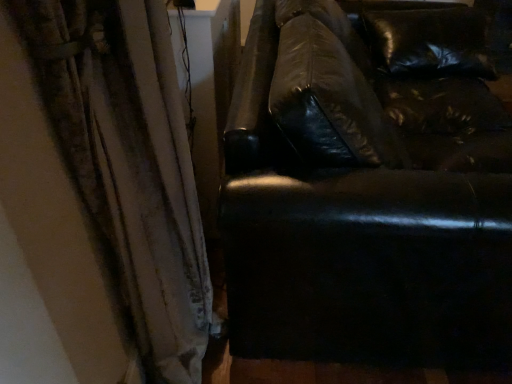
Image resolution: width=512 pixels, height=384 pixels. In order to click on shiny black leather couch at right in this screenshot , I will do `click(368, 191)`.

This screenshot has width=512, height=384. What do you see at coordinates (368, 191) in the screenshot?
I see `shiny black leather couch at right` at bounding box center [368, 191].

Measure the distance between point (225, 233) and camera.

A distance of 34.72 inches exists between point (225, 233) and camera.

The width and height of the screenshot is (512, 384). I want to click on white textured curtain at left, so [x=128, y=162].

What do you see at coordinates (128, 162) in the screenshot? This screenshot has width=512, height=384. I see `white textured curtain at left` at bounding box center [128, 162].

What are the coordinates of `shiny black leather couch at right` in the screenshot? It's located at (368, 191).

Considering the positions of objects shiny black leather couch at right and white textured curtain at left in the image provided, who is more to the right, shiny black leather couch at right or white textured curtain at left?

Positioned to the right is shiny black leather couch at right.

Is the position of shiny black leather couch at right more distant than that of white textured curtain at left?

Yes, shiny black leather couch at right is further from the camera.

Is point (291, 192) positioned behind point (204, 291)?

That is False.

From the image's perspective, is shiny black leather couch at right above white textured curtain at left?

Correct, shiny black leather couch at right appears higher than white textured curtain at left in the image.

From a real-world perspective, relative to white textured curtain at left, is shiny black leather couch at right vertically above or below?

In terms of real-world spatial position, shiny black leather couch at right is below white textured curtain at left.

Can you confirm if shiny black leather couch at right is wider than white textured curtain at left?

Yes.

Can you confirm if shiny black leather couch at right is taller than white textured curtain at left?

No.

Between shiny black leather couch at right and white textured curtain at left, which one has larger size?

shiny black leather couch at right is bigger.

Consider the image. Is shiny black leather couch at right surrounding white textured curtain at left?

No, white textured curtain at left is not surrounded by shiny black leather couch at right.

Is shiny black leather couch at right touching white textured curtain at left?

No, shiny black leather couch at right is not beside white textured curtain at left.

Is shiny black leather couch at right aimed at white textured curtain at left?

No, shiny black leather couch at right is not turned towards white textured curtain at left.

How far apart are shiny black leather couch at right and white textured curtain at left?

shiny black leather couch at right is 13.21 inches from white textured curtain at left.

Locate an element on the screen. The height and width of the screenshot is (384, 512). curtain on the left of shiny black leather couch at right is located at coordinates (128, 162).

Between white textured curtain at left and shiny black leather couch at right, which one appears on the left side from the viewer's perspective?

white textured curtain at left.

Is white textured curtain at left in front of or behind shiny black leather couch at right in the image?

Clearly, white textured curtain at left is in front of shiny black leather couch at right.

Which is less distant, (x=134, y=180) or (x=364, y=253)?

Clearly, point (x=134, y=180) is closer to the camera than point (x=364, y=253).

From the image's perspective, between white textured curtain at left and shiny black leather couch at right, who is located below?

white textured curtain at left.

From a real-world perspective, between white textured curtain at left and shiny black leather couch at right, who is vertically lower?

shiny black leather couch at right, from a real-world perspective.

Between white textured curtain at left and shiny black leather couch at right, which one has larger width?

shiny black leather couch at right.

Who is taller, white textured curtain at left or shiny black leather couch at right?

Standing taller between the two is white textured curtain at left.

Can you confirm if white textured curtain at left is smaller than shiny black leather couch at right?

Correct, white textured curtain at left occupies less space than shiny black leather couch at right.

Is shiny black leather couch at right a part of white textured curtain at left?

No, white textured curtain at left does not contain shiny black leather couch at right.

Is white textured curtain at left next to shiny black leather couch at right?

No, white textured curtain at left is not making contact with shiny black leather couch at right.

Is white textured curtain at left oriented towards shiny black leather couch at right?

Yes, white textured curtain at left is aimed at shiny black leather couch at right.

How different are the orientations of white textured curtain at left and shiny black leather couch at right in degrees?

0.585 degrees separate the facing orientations of white textured curtain at left and shiny black leather couch at right.

Consider the image. Measure the distance from white textured curtain at left to shiny black leather couch at right.

The distance of white textured curtain at left from shiny black leather couch at right is 13.21 inches.

Locate an element on the screen. curtain below the shiny black leather couch at right (from the image's perspective) is located at coordinates (128, 162).

Identify the location of curtain on the left of shiny black leather couch at right. This screenshot has height=384, width=512. (128, 162).

Locate an element on the screen. The height and width of the screenshot is (384, 512). studio couch that is on the right side of white textured curtain at left is located at coordinates (368, 191).